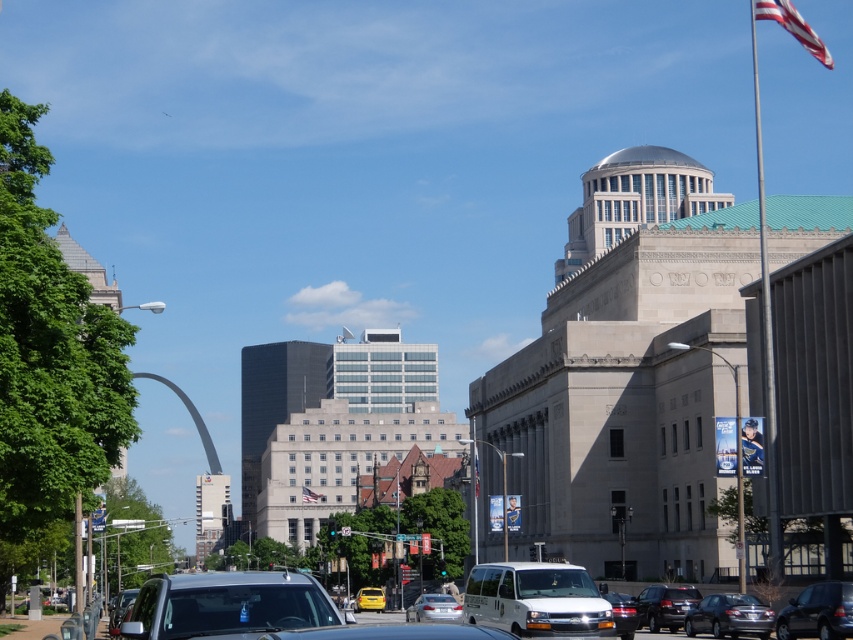
In the scene shown: You are a pedestrian standing at the edge of the street and see the white matte van at center and the yellow matte taxi at center. Which vehicle is closer to the right side of the road?

The white matte van at center is positioned on the right side of the yellow matte taxi at center, so it is closer to the right side of the road.

You are a photographer planning to take a picture of the red fabric flag at upper right and the shiny black sedan at center. Which object should you focus on first if you want to capture both in a single frame without moving the camera?

The red fabric flag at upper right should be focused on first because it is larger in size compared to the shiny black sedan at center, allowing it to be more prominent in the frame while still capturing the sedan in the background.

You are a photographer wanting to capture both the shiny silver sedan at lower right and the american flag at center in a single shot. Considering their heights, which object will appear taller in your photo?

The shiny silver sedan at lower right will appear taller in the photo because it has a greater height compared to the american flag at center.